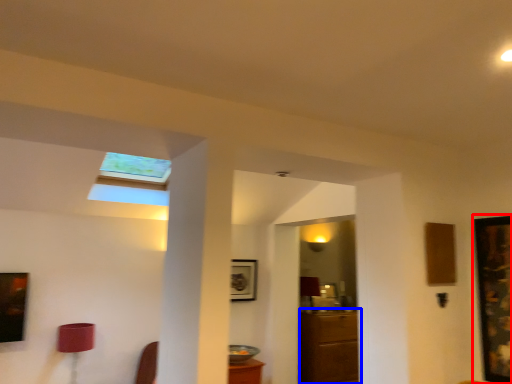
Question: Among these objects, which one is farthest to the camera, picture frame (highlighted by a red box) or furniture (highlighted by a blue box)?

Choices:
 (A) picture frame
 (B) furniture

Answer: (B)